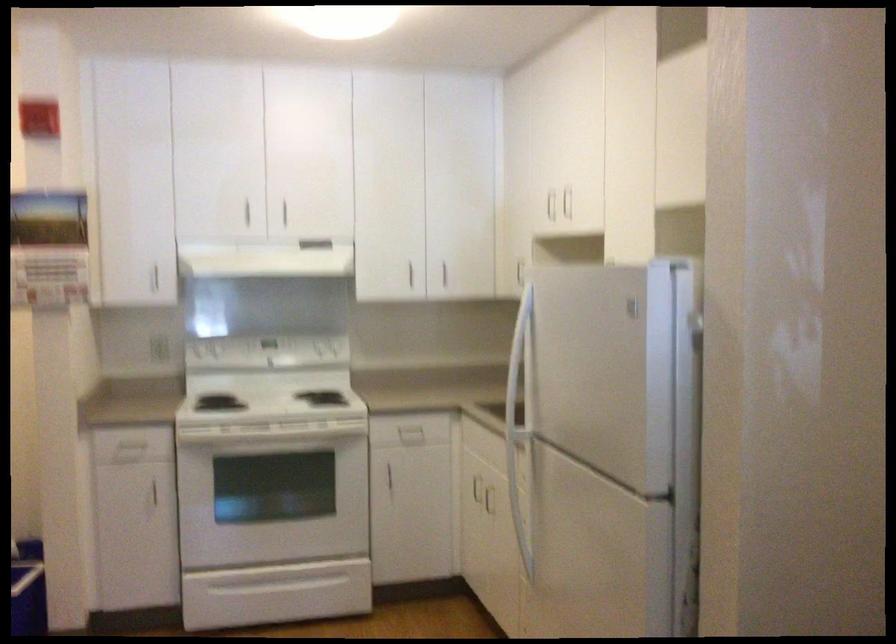
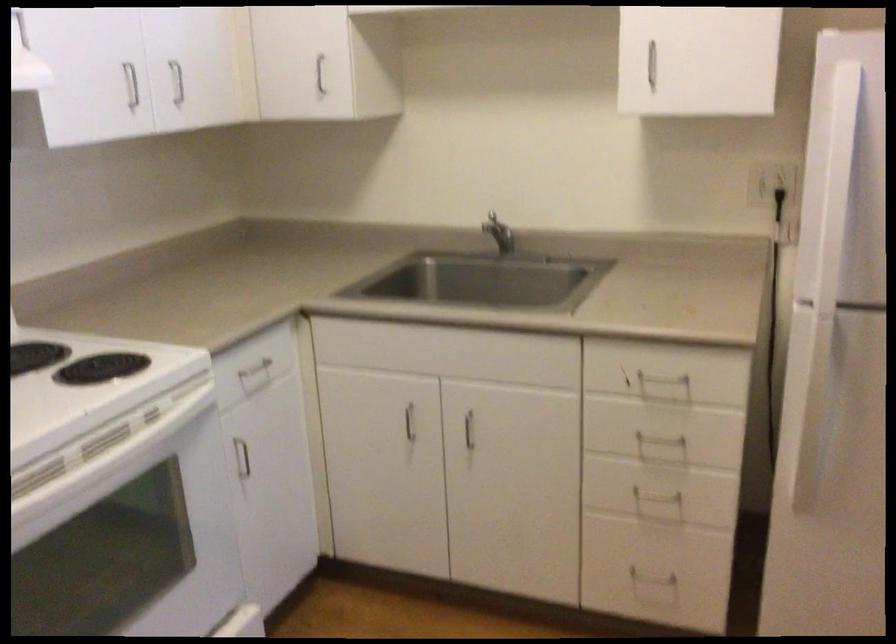
The point at (513,380) is marked in the first image. Where is the corresponding point in the second image?

(831, 240)